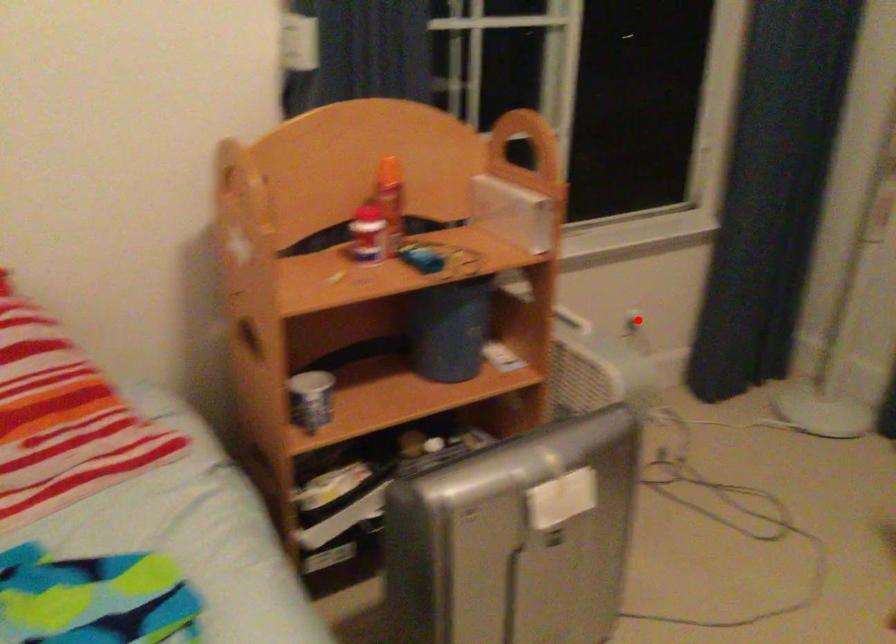
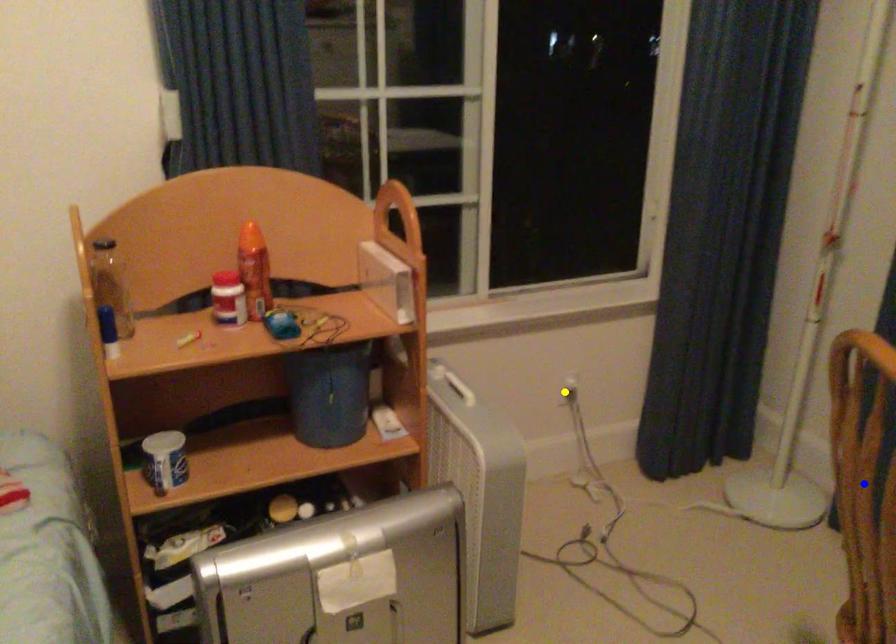
Question: I am providing you with two images of the same scene from different viewpoints. A red point is marked on the first image. You are given multiple points on the second image. In image 2, which mark is for the same physical point as the one in image 1?

Choices:
 (A) green point
 (B) blue point
 (C) yellow point

Answer: (C)